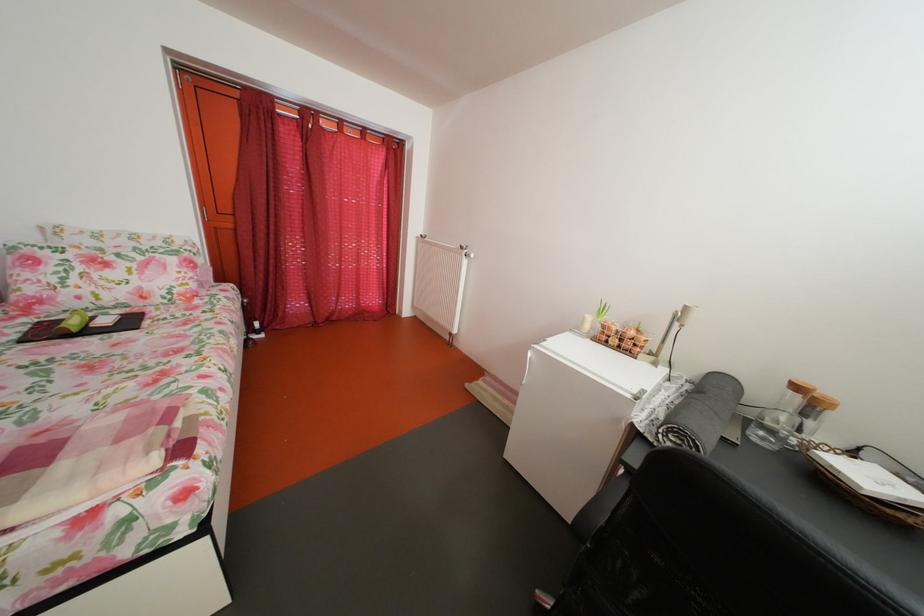
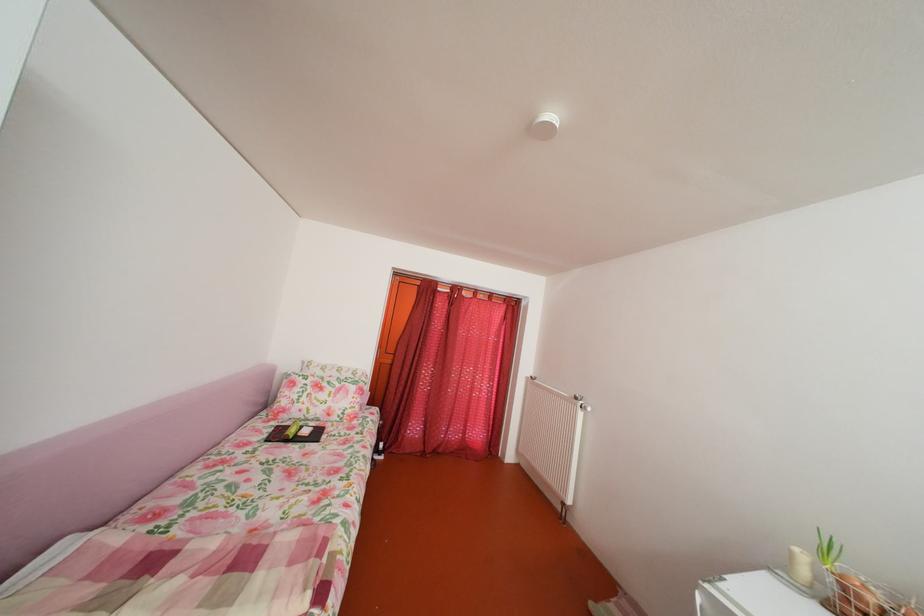
The point at (473, 254) is marked in the first image. Where is the corresponding point in the second image?

(588, 405)